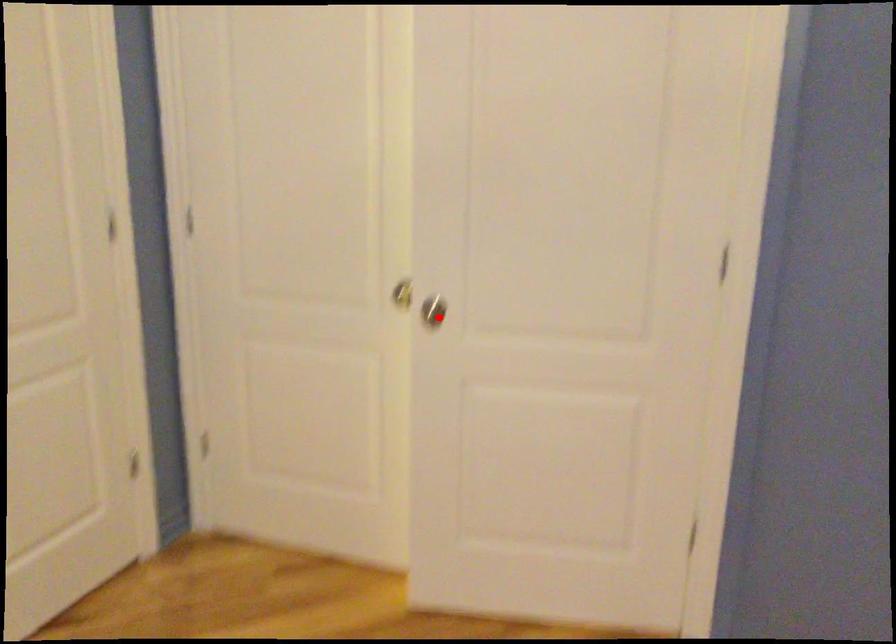
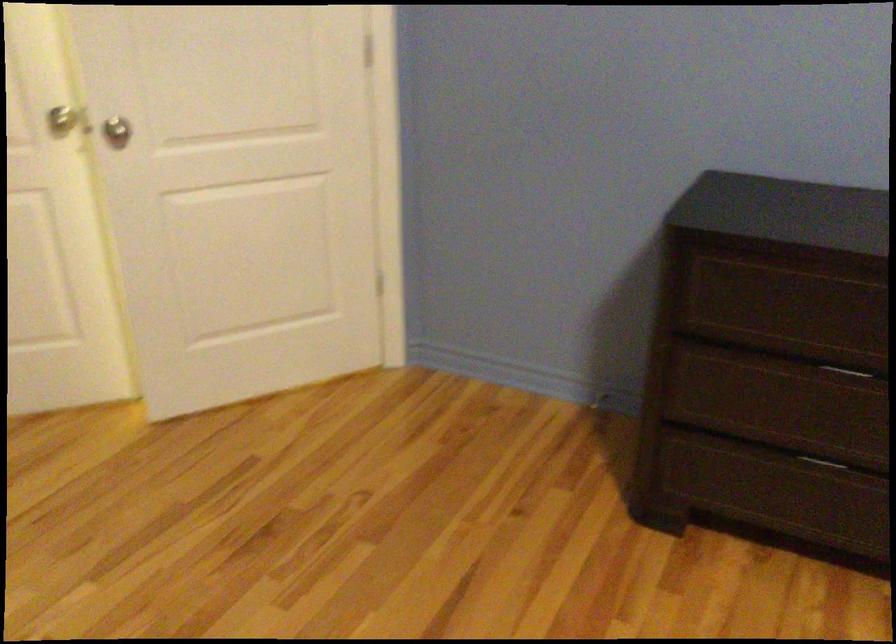
Where in the second image is the point corresponding to the highlighted location from the first image?

(116, 131)